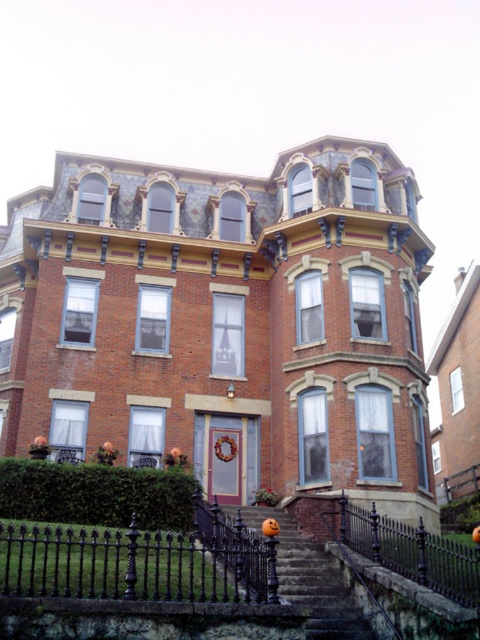
Question: Which of the following is the farthest from the observer?

Choices:
 (A) black wrought iron fence at lower right
 (B) smooth stone stairs at center
 (C) black wrought iron fence at lower center
 (D) green leafy hedge at lower left

Answer: (D)

Question: Is black wrought iron fence at lower center thinner than green leafy hedge at lower left?

Choices:
 (A) no
 (B) yes

Answer: (A)

Question: Does black wrought iron fence at lower right appear over smooth stone stairs at center?

Choices:
 (A) no
 (B) yes

Answer: (B)

Question: Among these objects, which one is nearest to the camera?

Choices:
 (A) smooth stone stairs at center
 (B) black wrought iron fence at lower center
 (C) green leafy hedge at lower left

Answer: (B)

Question: Among these objects, which one is farthest from the camera?

Choices:
 (A) black wrought iron fence at lower center
 (B) smooth stone stairs at center

Answer: (B)

Question: In this image, where is black wrought iron fence at lower center located relative to green leafy hedge at lower left?

Choices:
 (A) right
 (B) left

Answer: (A)